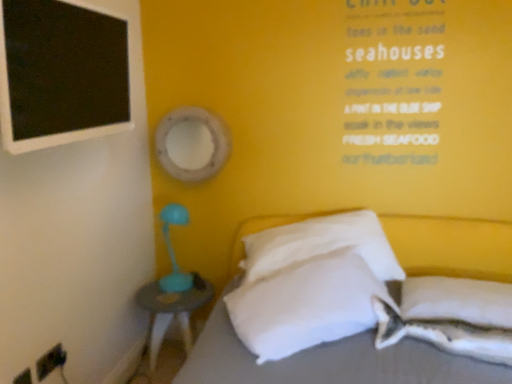
Question: In terms of size, does black matte board at upper left appear bigger or smaller than teal plastic nightstand at lower left?

Choices:
 (A) big
 (B) small

Answer: (A)

Question: Considering the positions of black matte board at upper left and teal plastic nightstand at lower left in the image, is black matte board at upper left taller or shorter than teal plastic nightstand at lower left?

Choices:
 (A) tall
 (B) short

Answer: (A)

Question: Which object is positioned closest to the black matte board at upper left?

Choices:
 (A) white soft pillow at center, which appears as the third pillow when viewed from the right
 (B) white soft pillow at center, the 1th pillow from the left
 (C) white soft pillow at lower right, the second pillow from the right
 (D) white soft pillow at lower right, the 4th pillow from the left
 (E) teal plastic nightstand at lower left

Answer: (B)

Question: Estimate the real-world distances between objects in this image. Which object is closer to the white soft pillow at center, the 1th pillow from the left?

Choices:
 (A) black matte board at upper left
 (B) white soft pillow at lower right, the 4th pillow from the left
 (C) white soft pillow at center, the 2th pillow in the left-to-right sequence
 (D) white fabric bed at lower right
 (E) teal plastic nightstand at lower left

Answer: (D)